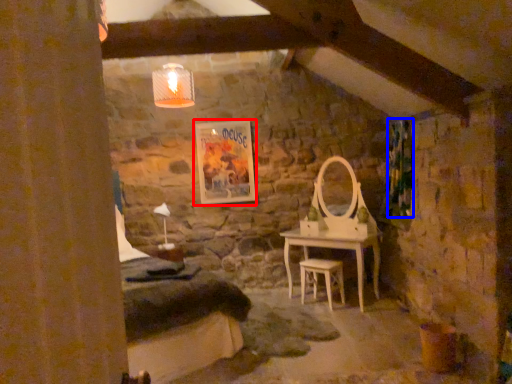
Question: Among these objects, which one is farthest to the camera, picture frame (highlighted by a red box) or curtain (highlighted by a blue box)?

Choices:
 (A) picture frame
 (B) curtain

Answer: (A)